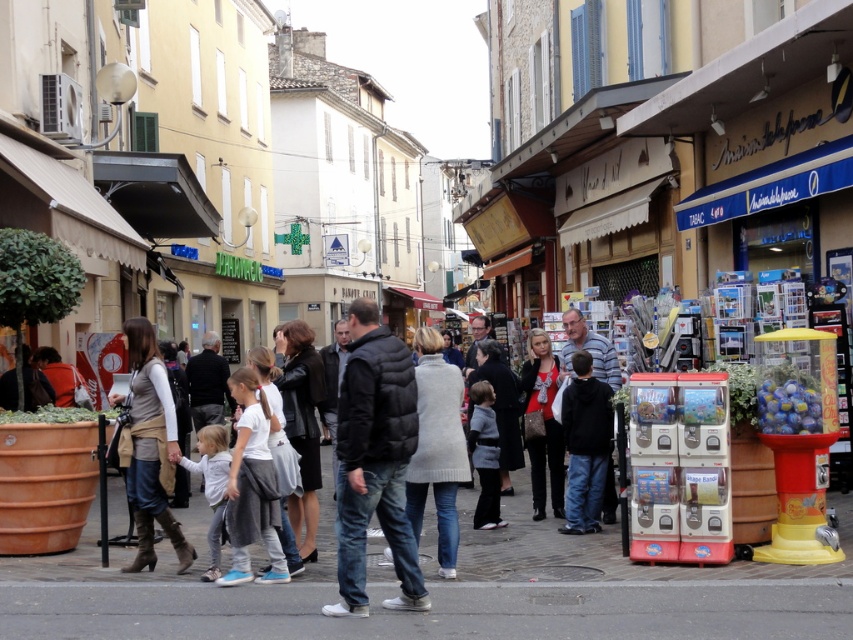
Is light brown leather jacket at center thinner than matte black dress at center?

No.

Between point (152, 560) and point (537, 506), which one is positioned behind?

Point (537, 506)

Find the location of `light brown leather jacket at center`. light brown leather jacket at center is located at coordinates (149, 448).

Which is below, matte black dress at center or gray wool sweater at center?

Positioned lower is gray wool sweater at center.

Is point (543, 512) farther from camera compared to point (480, 392)?

Yes, it is behind point (480, 392).

The height and width of the screenshot is (640, 853). Identify the location of matte black dress at center. (543, 424).

Is light brown leather jacket at center closer to camera compared to gray wool sweater at center?

That is True.

The height and width of the screenshot is (640, 853). What are the coordinates of `light brown leather jacket at center` in the screenshot? It's located at (149, 448).

Find the location of a particular element. light brown leather jacket at center is located at coordinates (149, 448).